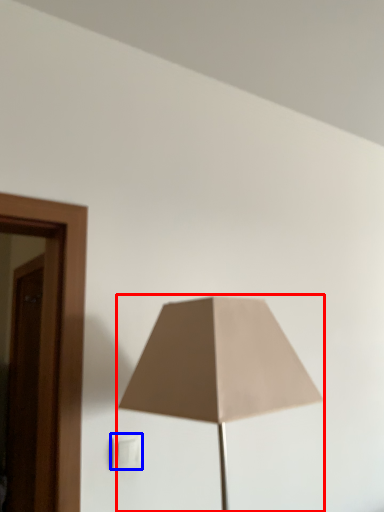
Question: Which of the following is the farthest to the observer, lamp (highlighted by a red box) or electric outlet (highlighted by a blue box)?

Choices:
 (A) lamp
 (B) electric outlet

Answer: (B)